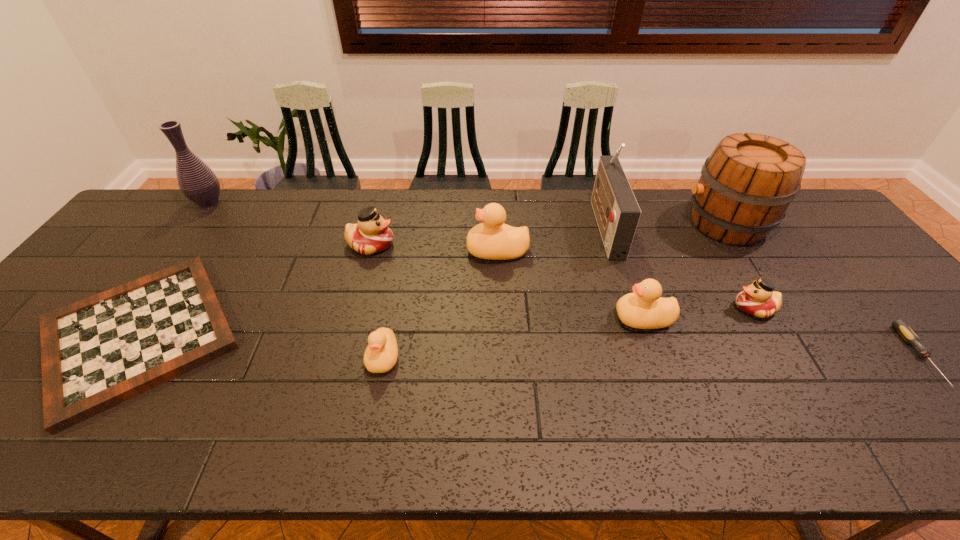
Where is `the right red duck`? The image size is (960, 540). the right red duck is located at coordinates (758, 299).

You are a GUI agent. You are given a task and a screenshot of the screen. Output one action in this format:
    pyautogui.click(x=<x>, y=<y>)
    Task: Click on the nearest duck
    Image resolution: width=960 pixels, height=540 pixels.
    Given the screenshot: What is the action you would take?
    pyautogui.click(x=380, y=356)

The height and width of the screenshot is (540, 960). Identify the location of the nearest yellow duck. (380, 356).

This screenshot has height=540, width=960. I want to click on the rightmost object, so click(900, 325).

Identify the location of screwdriver. Image resolution: width=960 pixels, height=540 pixels. (900, 325).

Where is `free spot located 0.340m on the right of the vase`? Image resolution: width=960 pixels, height=540 pixels. free spot located 0.340m on the right of the vase is located at coordinates (327, 202).

At what (x,y) coordinates should I click in order to perform the action: click on vacant region located 0.080m on the front panel of the radio receiver. Please return your answer as a coordinate pair (x, y). Looking at the image, I should click on (569, 226).

Where is `vacant region located on the front panel of the radio receiver`? vacant region located on the front panel of the radio receiver is located at coordinates (572, 226).

At what (x,y) coordinates should I click in order to perform the action: click on vacant region located 0.400m on the front panel of the radio receiver. Please return your answer as a coordinate pair (x, y). The image size is (960, 540). Looking at the image, I should click on (468, 226).

Image resolution: width=960 pixels, height=540 pixels. What are the coordinates of `vacant region located 0.100m on the side of the cider where the spigot is located` in the screenshot? It's located at (650, 223).